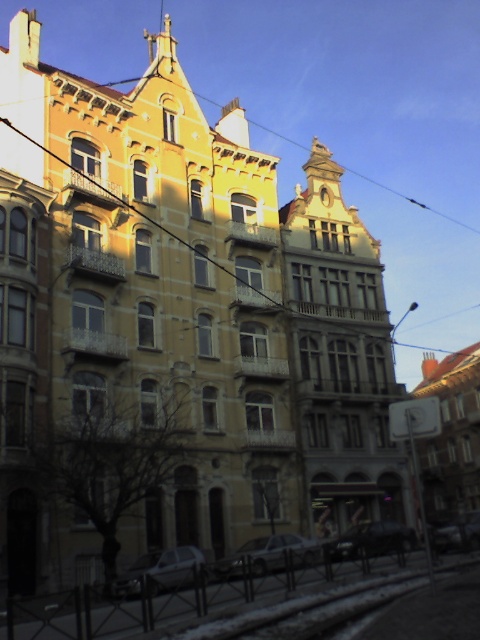
You are a pedestrian standing in front of the building and want to reach the shiny black car at lower center. Which direction should you walk to avoid the yellow matte clock at upper center?

The shiny black car at lower center is positioned under the yellow matte clock at upper center, so walking directly towards the car would mean passing under the clock. To avoid the clock, walk to the side of the shiny black car at lower center where the clock is not overhead.

You are a delivery person trying to park your shiny black car at lower center in front of the building. The parking space is exactly as wide as the yellow matte clock at upper center. Will your car fit?

The shiny black car at lower center might be wider than the yellow matte clock at upper center, so there is a possibility that the car will not fit in the parking space.